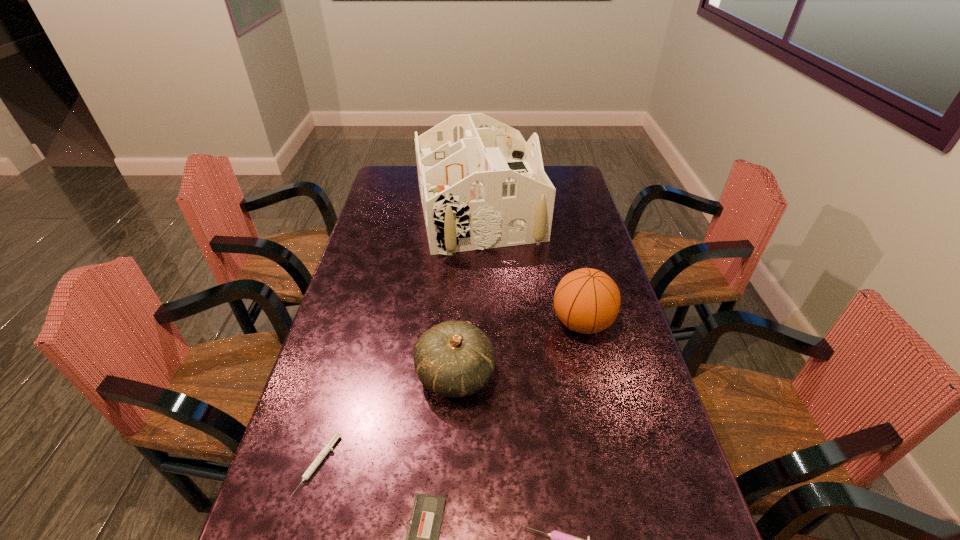
You are a GUI agent. You are given a task and a screenshot of the screen. Output one action in this format:
    pyautogui.click(x=<x>, y=<y>)
    Task: Click on the object situated at the far edge
    The width and height of the screenshot is (960, 540).
    Given the screenshot: What is the action you would take?
    pyautogui.click(x=482, y=186)

Find the location of a particular element. This screenshot has height=540, width=960. object located in the left edge section of the desktop is located at coordinates (327, 448).

Find the location of a particular element. This screenshot has height=540, width=960. object present at the right edge is located at coordinates (586, 300).

At what (x,y) coordinates should I click in order to perform the action: click on vacant space at the left edge. Please return your answer as a coordinate pair (x, y). Image resolution: width=960 pixels, height=540 pixels. Looking at the image, I should click on (340, 369).

You are a GUI agent. You are given a task and a screenshot of the screen. Output one action in this format:
    pyautogui.click(x=<x>, y=<y>)
    Task: Click on the free location at the right edge of the desktop
    The image size is (960, 540).
    Given the screenshot: What is the action you would take?
    point(612,397)

Locate an element on the screen. The width and height of the screenshot is (960, 540). free spot between the farthest object and the basketball is located at coordinates (530, 268).

The image size is (960, 540). Identify the location of blank region between the basketball and the gourd. (519, 349).

Find the location of `free space between the third tallest object and the farther syringe`. free space between the third tallest object and the farther syringe is located at coordinates (387, 420).

Find the location of a particular element. The width and height of the screenshot is (960, 540). empty space between the gourd and the second tallest object is located at coordinates (519, 349).

Where is `vacant area that lies between the farthest object and the third tallest object`? vacant area that lies between the farthest object and the third tallest object is located at coordinates (468, 295).